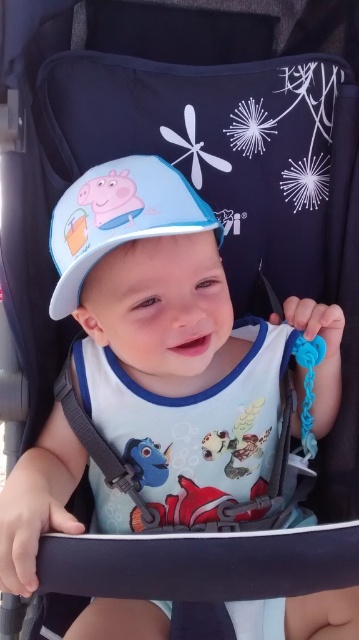
You are a parent holding a baby bottle and want to feed the child in the stroller. The white matte bib at center and the matte blue fabric hat at center are both in front of you. How far apart are these two items?

The distance between the white matte bib at center and the matte blue fabric hat at center is 10.37 inches.

You are a parent looking at the stroller and want to place a pacifier on the white matte bib at center. Based on the coordinates provided, where exactly should you place it?

The white matte bib at center is located at coordinates point (193, 426), so place the pacifier there.